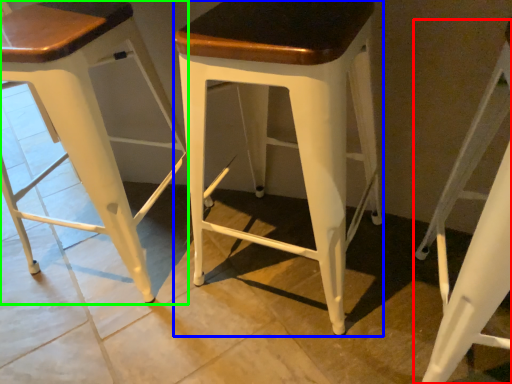
Question: Which is farther away from stool (highlighted by a red box)? stool (highlighted by a blue box) or stool (highlighted by a green box)?

Choices:
 (A) stool
 (B) stool

Answer: (B)